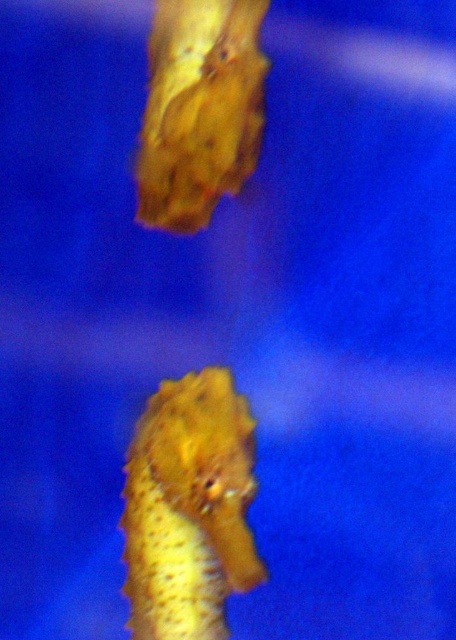
In the scene shown: You are standing in front of an aquarium and see a seahorse at point (223, 538). If you want to take a photo of it with your phone, which has a maximum focus distance of 1.5 meters, will you be able to focus on the seahorse?

Result: The distance between you and the seahorse at point (223, 538) is 1.25 meters, which is within your phone camera maximum focus distance of 1.5 meters. Therefore, you can focus on the seahorse.

You are an underwater photographer aiming to capture a closeup shot of the yellow matte seahorse at center and the yellow textured seahorse at upper center. Your camera can focus on subjects within a 40 centimeter range. Can both seahorses be in focus at the same time?

The yellow matte seahorse at center is 46.73 centimeters away from the yellow textured seahorse at upper center. Since the distance between them exceeds the camera focus range of 40 centimeters, both seahorses cannot be in focus simultaneously.